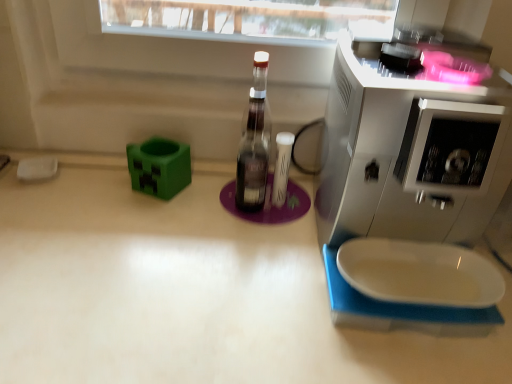
Question: From a real-world perspective, is white matte countertop at center located higher than white glossy coffee machine at upper right?

Choices:
 (A) yes
 (B) no

Answer: (B)

Question: Does white matte countertop at center have a lesser width compared to white glossy coffee machine at upper right?

Choices:
 (A) no
 (B) yes

Answer: (A)

Question: Is white matte countertop at center positioned with its back to white glossy coffee machine at upper right?

Choices:
 (A) yes
 (B) no

Answer: (B)

Question: Would you say white matte countertop at center is outside white glossy coffee machine at upper right?

Choices:
 (A) no
 (B) yes

Answer: (B)

Question: Is white matte countertop at center smaller than white glossy coffee machine at upper right?

Choices:
 (A) yes
 (B) no

Answer: (B)

Question: Could you tell me if white matte countertop at center is turned towards white glossy coffee machine at upper right?

Choices:
 (A) yes
 (B) no

Answer: (B)

Question: Could you tell me if white glossy coffee machine at upper right is facing white matte countertop at center?

Choices:
 (A) no
 (B) yes

Answer: (A)

Question: Can you confirm if white glossy coffee machine at upper right is bigger than white matte countertop at center?

Choices:
 (A) no
 (B) yes

Answer: (A)

Question: Is white glossy coffee machine at upper right completely or partially outside of white matte countertop at center?

Choices:
 (A) no
 (B) yes

Answer: (B)

Question: Is white glossy coffee machine at upper right thinner than white matte countertop at center?

Choices:
 (A) no
 (B) yes

Answer: (B)

Question: Is white glossy coffee machine at upper right wider than white matte countertop at center?

Choices:
 (A) yes
 (B) no

Answer: (B)

Question: Is white matte countertop at center a part of white glossy coffee machine at upper right?

Choices:
 (A) yes
 (B) no

Answer: (B)

Question: Choose the correct answer: Is white matte countertop at center inside white glossy coffee machine at upper right or outside it?

Choices:
 (A) inside
 (B) outside

Answer: (B)